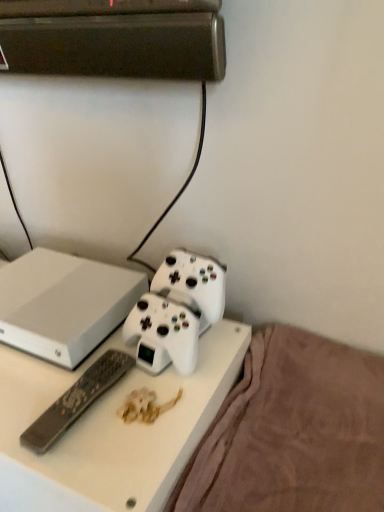
Question: Can black plastic remote at lower left be found inside white plastic desk at center?

Choices:
 (A) no
 (B) yes

Answer: (B)

Question: Is white plastic desk at center positioned before black plastic remote at lower left?

Choices:
 (A) yes
 (B) no

Answer: (A)

Question: Is white plastic desk at center thinner than black plastic remote at lower left?

Choices:
 (A) yes
 (B) no

Answer: (B)

Question: Are white plastic desk at center and black plastic remote at lower left far apart?

Choices:
 (A) no
 (B) yes

Answer: (A)

Question: Is white plastic desk at center shorter than black plastic remote at lower left?

Choices:
 (A) yes
 (B) no

Answer: (B)

Question: Is point (324, 390) positioned closer to the camera than point (82, 374)?

Choices:
 (A) closer
 (B) farther

Answer: (B)

Question: From their relative heights in the image, would you say brown plush blanket at lower right is taller or shorter than black plastic remote at lower left?

Choices:
 (A) short
 (B) tall

Answer: (B)

Question: From the image's perspective, relative to black plastic remote at lower left, is brown plush blanket at lower right above or below?

Choices:
 (A) below
 (B) above

Answer: (A)

Question: Considering the positions of brown plush blanket at lower right and black plastic remote at lower left in the image, is brown plush blanket at lower right wider or thinner than black plastic remote at lower left?

Choices:
 (A) wide
 (B) thin

Answer: (A)

Question: Is point (178, 502) closer or farther from the camera than point (147, 284)?

Choices:
 (A) closer
 (B) farther

Answer: (A)

Question: Which is correct: brown plush blanket at lower right is inside white matte gaming console at center, or outside of it?

Choices:
 (A) outside
 (B) inside

Answer: (A)

Question: Considering their positions, is brown plush blanket at lower right located in front of or behind white matte gaming console at center?

Choices:
 (A) behind
 (B) front

Answer: (B)

Question: Visually, is brown plush blanket at lower right positioned to the left or to the right of white matte gaming console at center?

Choices:
 (A) right
 (B) left

Answer: (A)

Question: In terms of width, does black plastic remote at lower left look wider or thinner when compared to white plastic desk at center?

Choices:
 (A) wide
 (B) thin

Answer: (B)

Question: From a real-world perspective, is black plastic remote at lower left physically located above or below white plastic desk at center?

Choices:
 (A) above
 (B) below

Answer: (A)